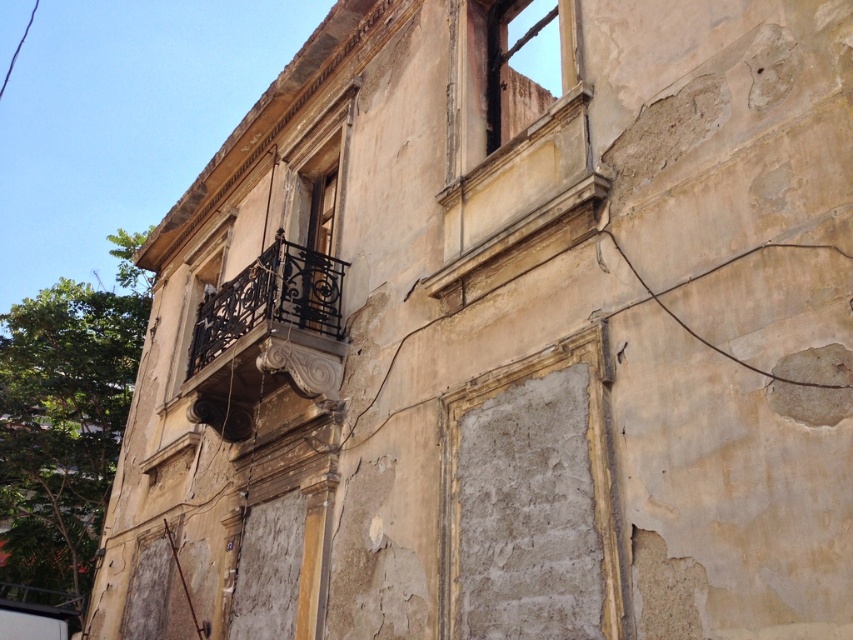
Question: Which object is farther from the camera taking this photo?

Choices:
 (A) black wrought iron balcony at center
 (B) rusty metal window at upper center

Answer: (A)

Question: Which of the following is the farthest from the observer?

Choices:
 (A) (x=329, y=396)
 (B) (x=491, y=116)

Answer: (A)

Question: Does black wrought iron balcony at center appear on the right side of rusty metal window at upper center?

Choices:
 (A) yes
 (B) no

Answer: (B)

Question: Does black wrought iron balcony at center appear on the left side of rusty metal window at upper center?

Choices:
 (A) no
 (B) yes

Answer: (B)

Question: Does black wrought iron balcony at center have a smaller size compared to rusty metal window at upper center?

Choices:
 (A) no
 (B) yes

Answer: (A)

Question: Which point appears closest to the camera in this image?

Choices:
 (A) (248, 396)
 (B) (518, 102)

Answer: (B)